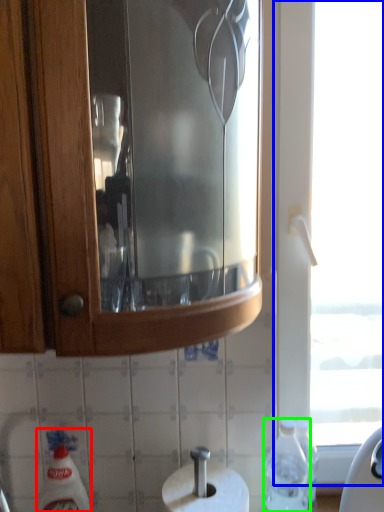
Question: Based on their relative distances, which object is farther from cleaning product (highlighted by a red box)? Choose from window (highlighted by a blue box) and bottle (highlighted by a green box).

Choices:
 (A) window
 (B) bottle

Answer: (A)